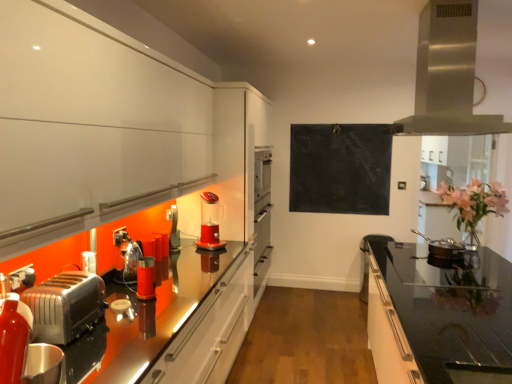
Question: In terms of width, does pink floral bouquet at right look wider or thinner when compared to black matte chalkboard at upper center?

Choices:
 (A) thin
 (B) wide

Answer: (B)

Question: Is pink floral bouquet at right spatially inside black matte chalkboard at upper center, or outside of it?

Choices:
 (A) inside
 (B) outside

Answer: (B)

Question: Which object is positioned closest to the pink floral bouquet at right?

Choices:
 (A) black matte chalkboard at upper center
 (B) black glass countertop at right
 (C) stainless steel range hood at upper right
 (D) translucent plastic blender at center
 (E) shiny silver pan at right, which is counted as the first appliance, starting from the back

Answer: (E)

Question: Estimate the real-world distances between objects in this image. Which object is farther from the shiny silver pan at right, which is the 2th appliance in front-to-back order?

Choices:
 (A) black matte chalkboard at upper center
 (B) translucent plastic blender at center
 (C) pink floral bouquet at right
 (D) stainless steel range hood at upper right
 (E) metallic red canister at center, arranged as the second appliance when viewed from the back

Answer: (E)